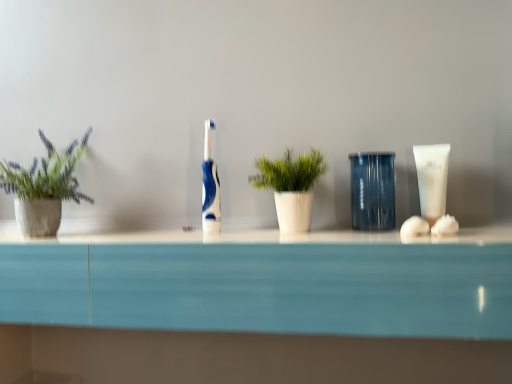
Question: From a real-world perspective, is white matte tube at right below green leafy plant in concrete pot at left, the first houseplant viewed from the left?

Choices:
 (A) no
 (B) yes

Answer: (B)

Question: From the image's perspective, is white matte tube at right below green leafy plant in concrete pot at left, the first houseplant viewed from the left?

Choices:
 (A) yes
 (B) no

Answer: (A)

Question: Can you confirm if white matte tube at right is shorter than green leafy plant in concrete pot at left, the first houseplant viewed from the left?

Choices:
 (A) no
 (B) yes

Answer: (B)

Question: Is white matte tube at right taller than green leafy plant in concrete pot at left, the first houseplant viewed from the left?

Choices:
 (A) yes
 (B) no

Answer: (B)

Question: Is white matte tube at right aimed at green leafy plant in concrete pot at left, positioned as the 2th houseplant in right-to-left order?

Choices:
 (A) no
 (B) yes

Answer: (A)

Question: From their relative heights in the image, would you say green leafy plant in concrete pot at left, the first houseplant viewed from the left, is taller or shorter than green glossy plant at center, arranged as the 2th houseplant when viewed from the left?

Choices:
 (A) tall
 (B) short

Answer: (A)

Question: Do you think green leafy plant in concrete pot at left, the first houseplant viewed from the left, is within green glossy plant at center, acting as the first houseplant starting from the right, or outside of it?

Choices:
 (A) outside
 (B) inside

Answer: (A)

Question: Is point (65, 150) closer or farther from the camera than point (310, 210)?

Choices:
 (A) farther
 (B) closer

Answer: (A)

Question: Is green leafy plant in concrete pot at left, positioned as the 2th houseplant in right-to-left order, to the left or to the right of green glossy plant at center, arranged as the 2th houseplant when viewed from the left, in the image?

Choices:
 (A) right
 (B) left

Answer: (B)

Question: In terms of height, does white matte tube at right look taller or shorter compared to green glossy plant at center, arranged as the 2th houseplant when viewed from the left?

Choices:
 (A) tall
 (B) short

Answer: (B)

Question: Which is correct: white matte tube at right is inside green glossy plant at center, arranged as the 2th houseplant when viewed from the left, or outside of it?

Choices:
 (A) inside
 (B) outside

Answer: (B)

Question: From the image's perspective, is white matte tube at right above or below green glossy plant at center, arranged as the 2th houseplant when viewed from the left?

Choices:
 (A) below
 (B) above

Answer: (B)

Question: Would you say white matte tube at right is to the left or to the right of green glossy plant at center, arranged as the 2th houseplant when viewed from the left, in the picture?

Choices:
 (A) left
 (B) right

Answer: (B)

Question: From a real-world perspective, is blue glossy toothbrush at center physically located above or below white matte tube at right?

Choices:
 (A) above
 (B) below

Answer: (A)

Question: Based on their sizes in the image, would you say blue glossy toothbrush at center is bigger or smaller than white matte tube at right?

Choices:
 (A) small
 (B) big

Answer: (B)